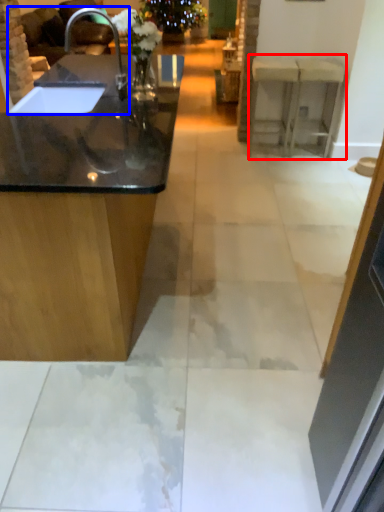
Question: Which object appears closest to the camera in this image, counter (highlighted by a red box) or sink (highlighted by a blue box)?

Choices:
 (A) counter
 (B) sink

Answer: (B)